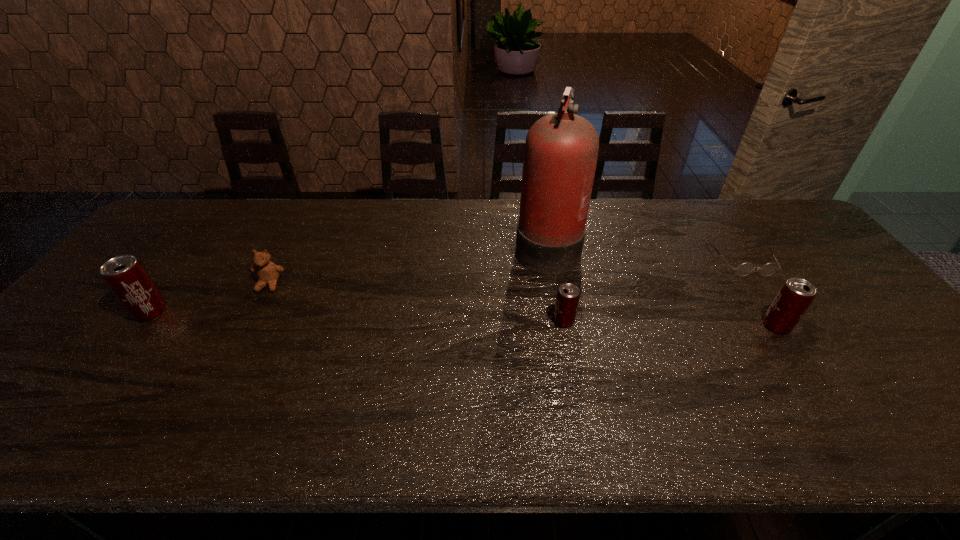
Locate an element on the screen. The height and width of the screenshot is (540, 960). unoccupied position between the fire extinguisher and the teddy bear is located at coordinates (408, 265).

The image size is (960, 540). Find the location of `free area in between the second tallest object and the fire extinguisher`. free area in between the second tallest object and the fire extinguisher is located at coordinates (348, 279).

Identify the location of free space between the second beer can from left to right and the fourth shortest object. (670, 323).

Where is `vacant area that lies between the second beer can from right to left and the tallest object`? vacant area that lies between the second beer can from right to left and the tallest object is located at coordinates (555, 283).

Locate an element on the screen. the third closest object to the leftmost object is located at coordinates point(568,295).

Locate an element on the screen. The height and width of the screenshot is (540, 960). the closest object to the second beer can from left to right is located at coordinates click(561, 149).

Identify which beer can is the closest to the tallest object. Please provide its 2D coordinates. Your answer should be formatted as a tuple, i.e. [(x, y)], where the tuple contains the x and y coordinates of a point satisfying the conditions above.

[(568, 295)]

Image resolution: width=960 pixels, height=540 pixels. Identify the location of beer can object that ranks as the second closest to the tallest beer can. (795, 296).

The image size is (960, 540). In order to click on free location that satisfies the following two spatial constraints: 1. at the nozzle of the fire extinguisher; 2. on the right side of the second shortest beer can in this screenshot , I will do `click(561, 326)`.

I want to click on free space in the image that satisfies the following two spatial constraints: 1. on the back side of the shortest beer can; 2. at the nozzle of the fire extinguisher, so click(549, 245).